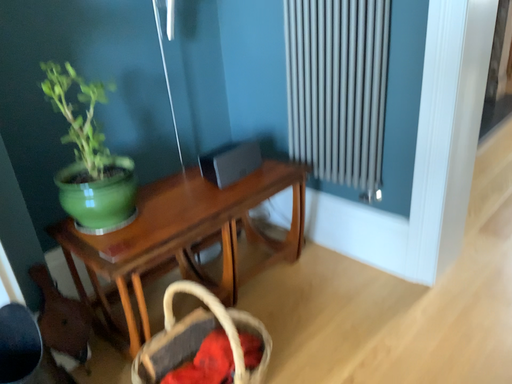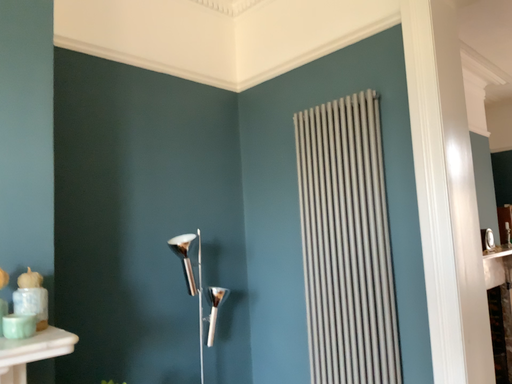
Question: How did the camera likely rotate when shooting the video?

Choices:
 (A) rotated downward
 (B) rotated upward

Answer: (B)